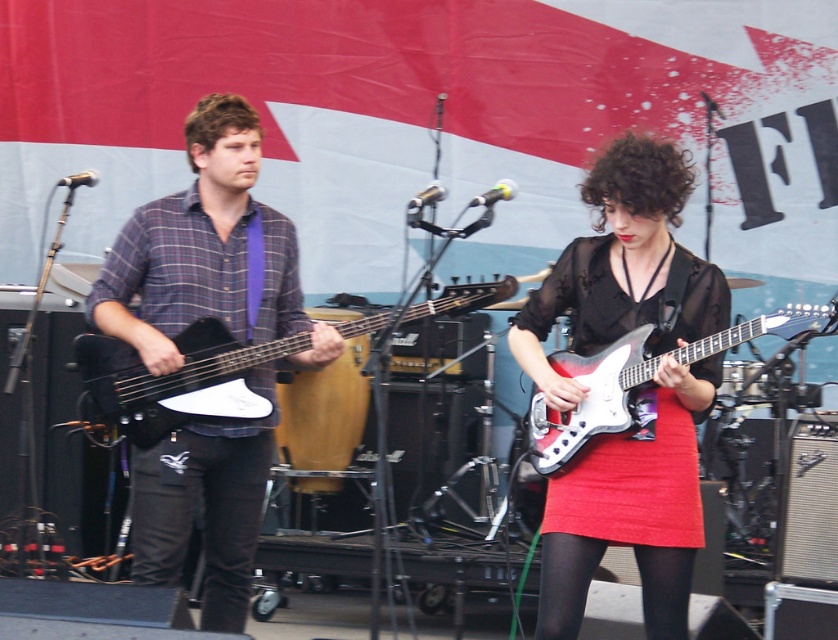
Question: Is shiny black dress at center to the right of matte black electric guitar at center from the viewer's perspective?

Choices:
 (A) no
 (B) yes

Answer: (B)

Question: Estimate the real-world distances between objects in this image. Which object is farther from the matte black electric guitar at center?

Choices:
 (A) matte plaid shirt at center
 (B) black denim pants at left

Answer: (B)

Question: Which point is farther from the camera taking this photo?

Choices:
 (A) (123, 349)
 (B) (536, 433)
 (C) (603, 323)

Answer: (A)

Question: Estimate the real-world distances between objects in this image. Which object is closer to the shiny metallic guitar at center?

Choices:
 (A) black denim pants at left
 (B) matte black electric guitar at center
 (C) shiny black dress at center

Answer: (C)

Question: Is matte plaid shirt at center thinner than shiny metallic guitar at center?

Choices:
 (A) no
 (B) yes

Answer: (A)

Question: Where is shiny black dress at center located in relation to matte black electric guitar at center in the image?

Choices:
 (A) right
 (B) left

Answer: (A)